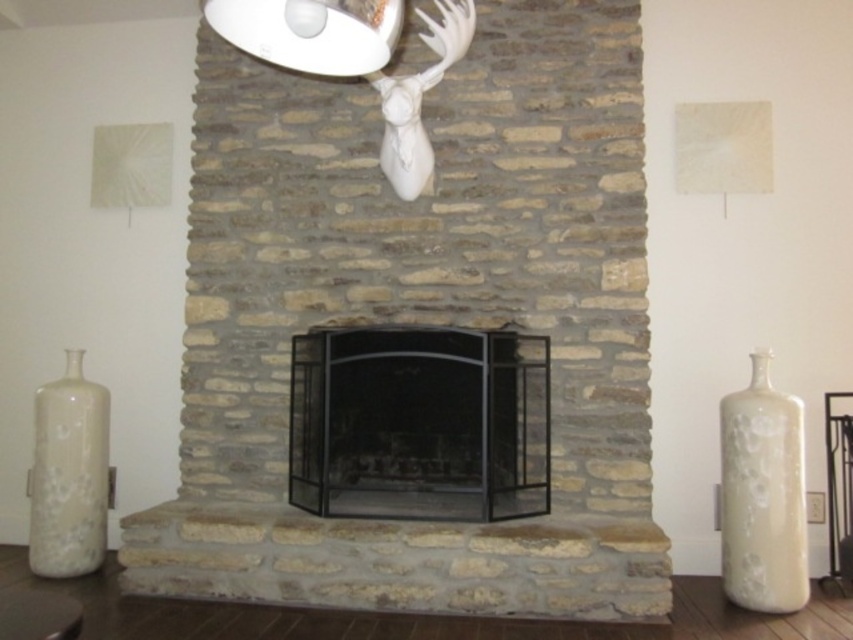
You are an interior designer assessing the placement of the white glossy vase at right and the white glossy lampshade at upper center. Based on their positions, which object would appear closer to you when standing in front of the fireplace?

The white glossy vase at right is closer to you because it is further to the viewer than the white glossy lampshade at upper center, meaning it appears nearer in the spatial arrangement.

Looking at this image, you are standing in the living room and want to place a 10 feet long decorative banner that needs to be hung on the wall behind the natural stone fireplace at center. Can the banner be displayed properly?

The natural stone fireplace at center is 9.72 feet away from the viewer. Since the banner is 10 feet long, it will extend slightly beyond the fireplace, but as long as the wall space behind is wide enough, it should fit. However, the exact placement depends on the banner width and wall dimensions not specified here.

You are standing in the living room facing the fireplace. There are two points marked on the wall near the fireplace. The first point is at coordinate point(614, 13) and the second is at point(317, 61). If you want to hang a picture between these two points, which point should be closer to the back wall?

Point(614, 13) is behind point(317, 61), so the picture should be placed closer to point(614, 13) to ensure it is nearer to the back wall.